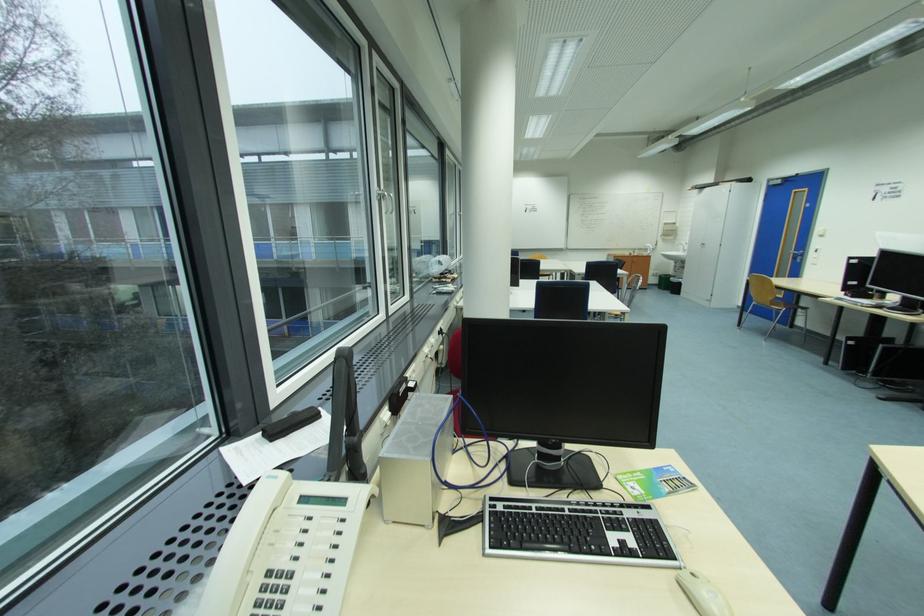
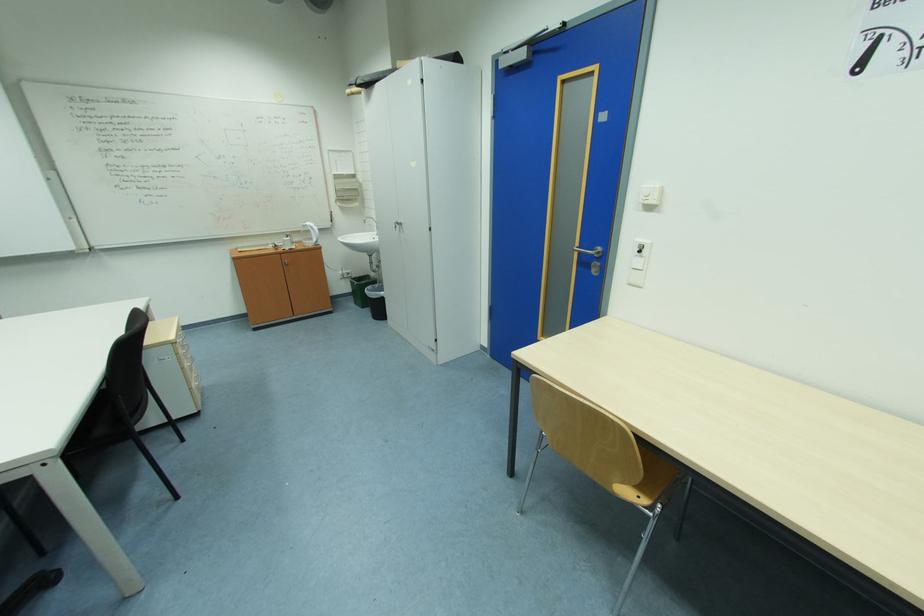
Find the pixel in the second image that matches pixel 666 290 in the first image.

(362, 304)